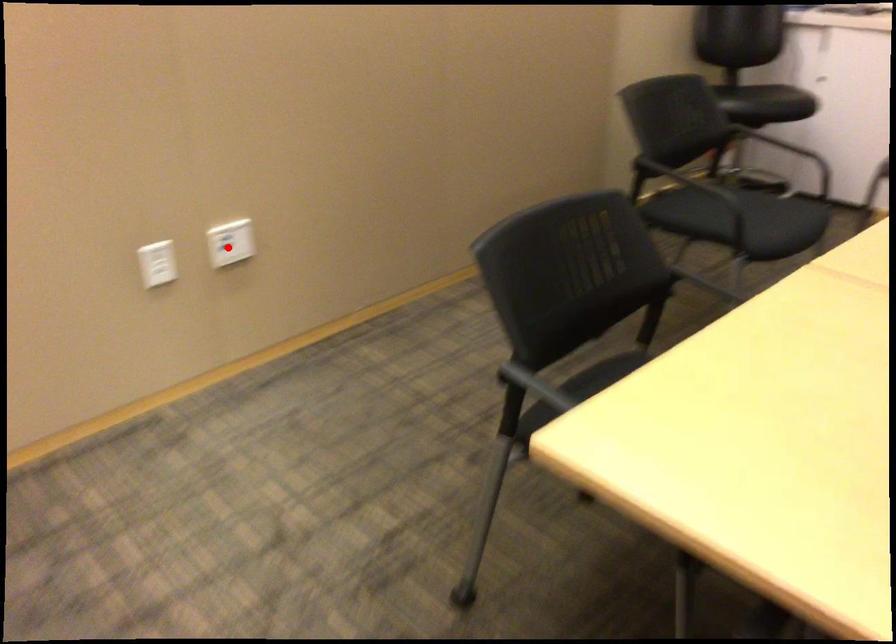
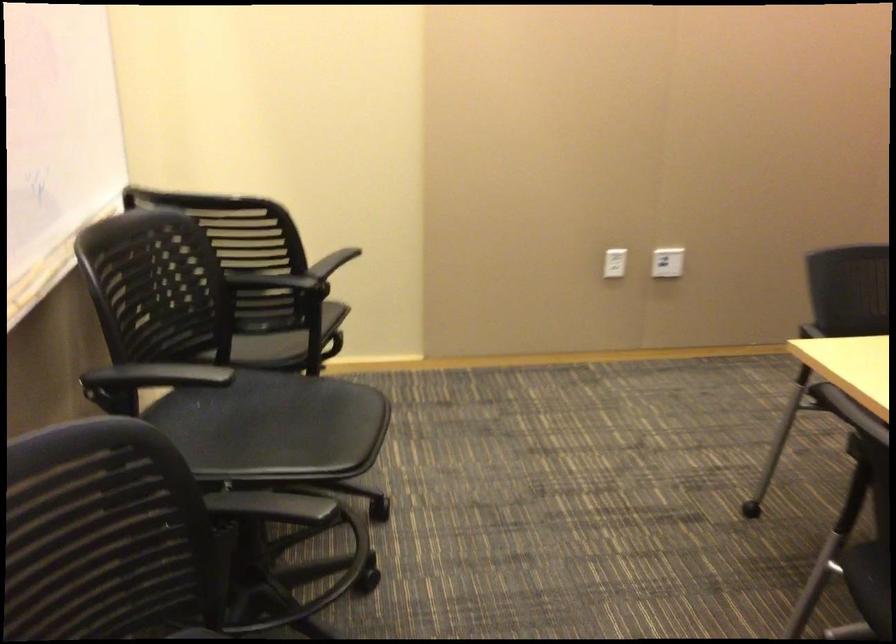
Question: I am providing you with two images of the same scene from different viewpoints. A red point is shown in image1. For the corresponding object point in image2, is it positioned nearer or farther from the camera?

Choices:
 (A) Nearer
 (B) Farther

Answer: (B)